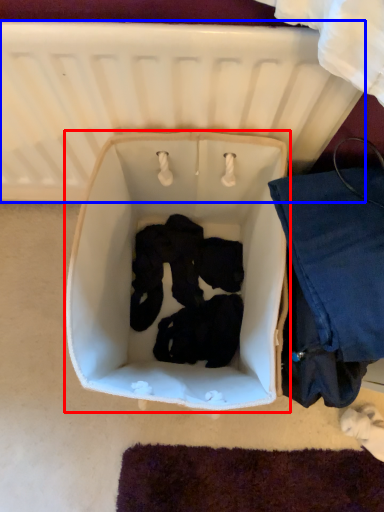
Question: Which object is further to the camera taking this photo, baby carriage (highlighted by a red box) or infant bed (highlighted by a blue box)?

Choices:
 (A) baby carriage
 (B) infant bed

Answer: (A)